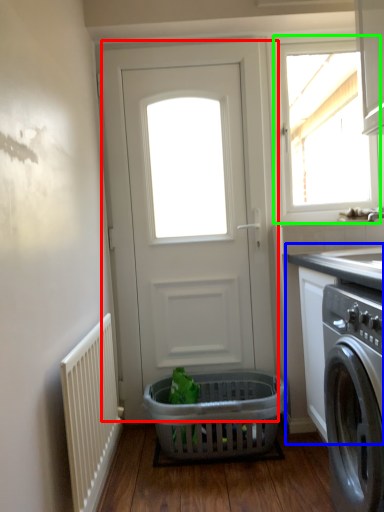
Question: Considering the real-world distances, which object is farthest from door (highlighted by a red box)? counter top (highlighted by a blue box) or window (highlighted by a green box)?

Choices:
 (A) counter top
 (B) window

Answer: (B)